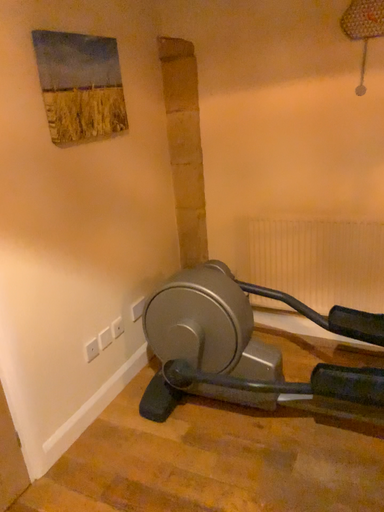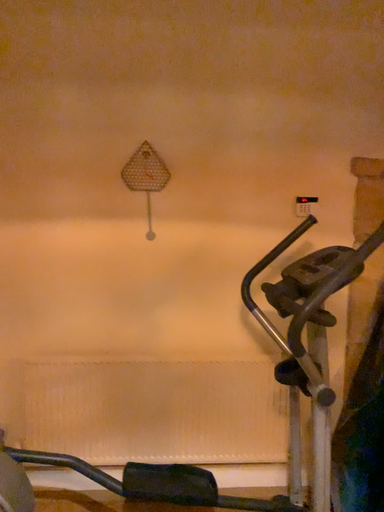
Question: Which way did the camera rotate in the video?

Choices:
 (A) rotated downward
 (B) rotated upward

Answer: (B)